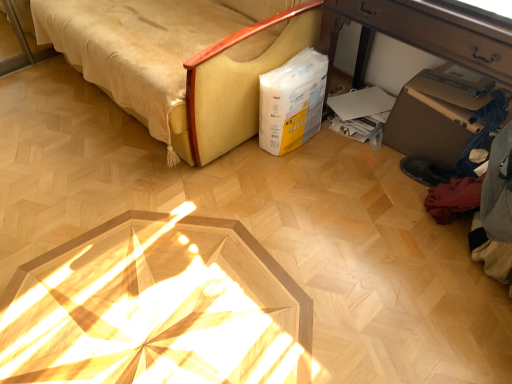
Where is `empty space that is in between beige fabric sofa at upper left and wooden desk at lower right`? empty space that is in between beige fabric sofa at upper left and wooden desk at lower right is located at coordinates (312, 178).